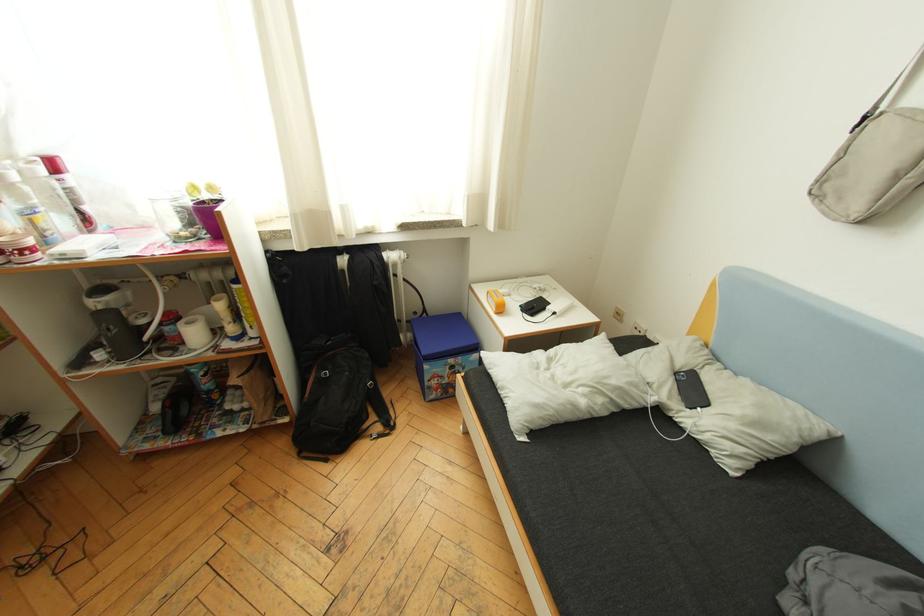
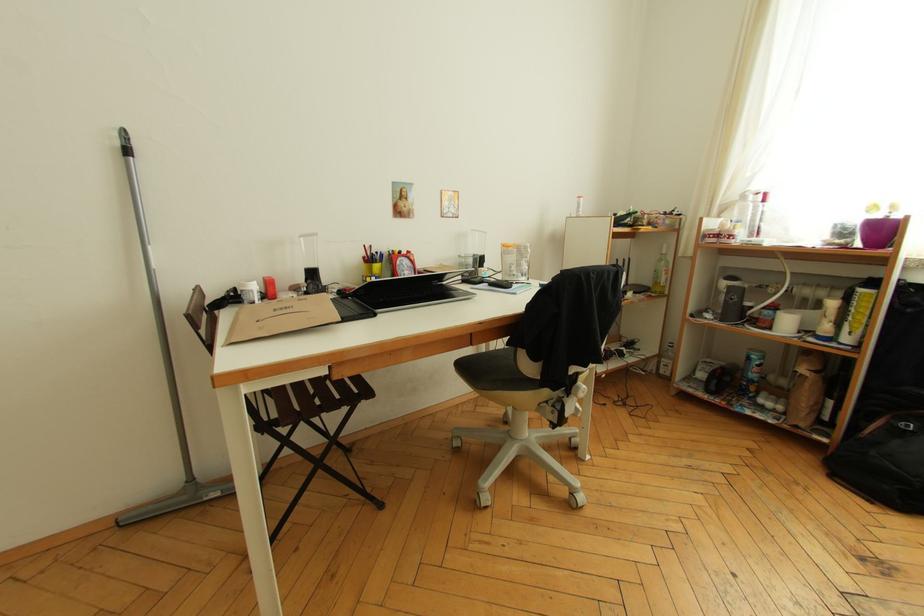
Question: Based on the continuous images, in which direction is the camera rotating? Reply with the corresponding letter.

Choices:
 (A) Left
 (B) Right
 (C) Up
 (D) Down

Answer: (A)